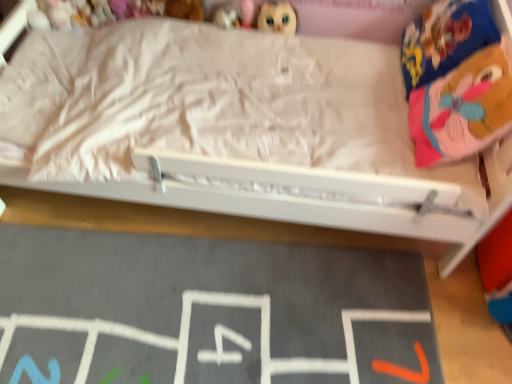
This screenshot has height=384, width=512. Find the location of `free space above white fabric bed at upper center (from a real-world perspective)`. free space above white fabric bed at upper center (from a real-world perspective) is located at coordinates (222, 287).